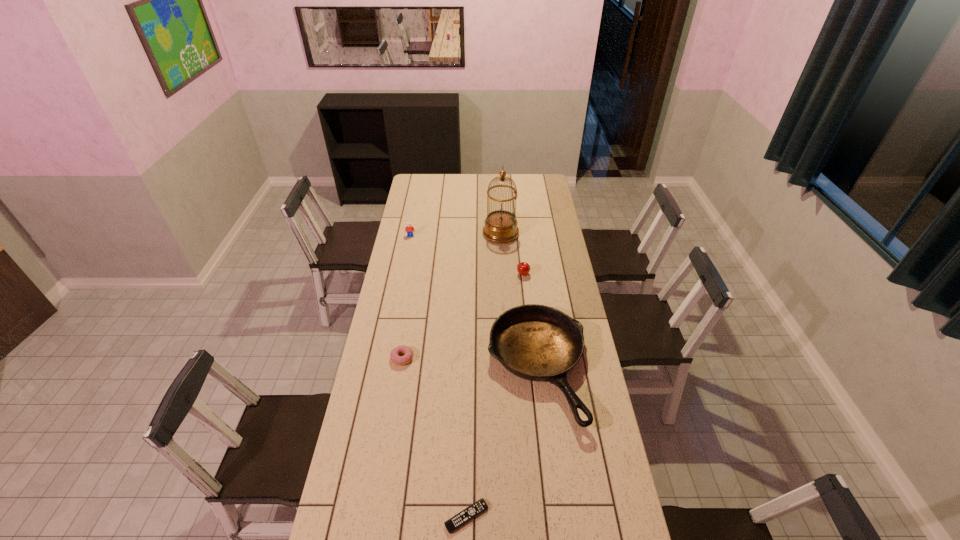
Identify the location of free point between the remote control and the second shortest object. (434, 437).

Identify the location of unoccupied position between the tallest object and the cherry. (512, 254).

Identify which object is the nearest to the Lego. Please provide its 2D coordinates. Your answer should be formatted as a tuple, i.e. [(x, y)], where the tuple contains the x and y coordinates of a point satisfying the conditions above.

[(500, 226)]

At what (x,y) coordinates should I click in order to perform the action: click on the fourth closest object to the nearest object. Please return your answer as a coordinate pair (x, y). Looking at the image, I should click on (500, 226).

Find the location of a particular element. The width and height of the screenshot is (960, 540). blank space that satisfies the following two spatial constraints: 1. on the face of the frying pan; 2. on the right side of the Lego is located at coordinates (385, 368).

I want to click on free space that satisfies the following two spatial constraints: 1. on the face of the Lego; 2. on the right side of the doughnut, so click(387, 358).

Find the location of `vacant space that satisfies the following two spatial constraints: 1. on the face of the remote control; 2. on the right side of the Lego`. vacant space that satisfies the following two spatial constraints: 1. on the face of the remote control; 2. on the right side of the Lego is located at coordinates (355, 516).

Identify the location of free region that satisfies the following two spatial constraints: 1. with an open door on the birdcage; 2. on the left side of the third farthest object. (503, 274).

Where is `blank space that satisfies the following two spatial constraints: 1. on the back side of the doughnut; 2. on the right side of the third farthest object`? Image resolution: width=960 pixels, height=540 pixels. blank space that satisfies the following two spatial constraints: 1. on the back side of the doughnut; 2. on the right side of the third farthest object is located at coordinates (416, 274).